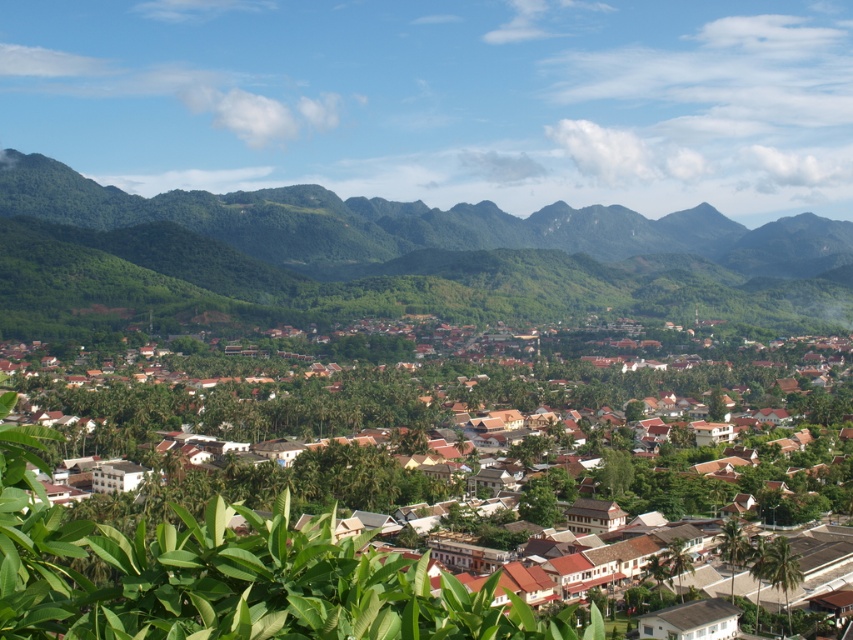
Question: Does green forested mountain at upper center appear over brown wooden houses at center?

Choices:
 (A) no
 (B) yes

Answer: (B)

Question: Can you confirm if green forested mountain at upper center is wider than brown wooden houses at center?

Choices:
 (A) yes
 (B) no

Answer: (A)

Question: Is green forested mountain at upper center thinner than brown wooden houses at center?

Choices:
 (A) no
 (B) yes

Answer: (A)

Question: Which of the following is the farthest from the observer?

Choices:
 (A) brown wooden houses at center
 (B) green forested mountain at upper center

Answer: (B)

Question: Which object is farther from the camera taking this photo?

Choices:
 (A) green forested mountain at upper center
 (B) brown wooden houses at center

Answer: (A)